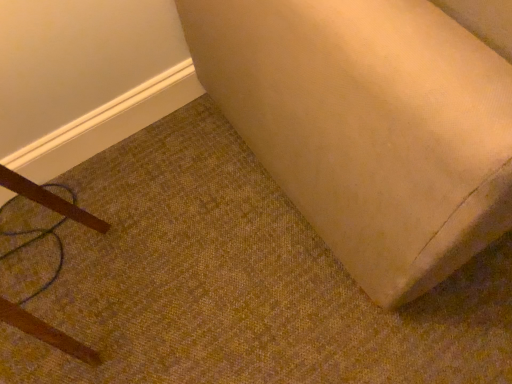
What do you see at coordinates (368, 126) in the screenshot?
I see `beige fabric ottoman at lower right` at bounding box center [368, 126].

Identify the location of beige fabric ottoman at lower right. This screenshot has height=384, width=512. (368, 126).

I want to click on beige fabric ottoman at lower right, so click(368, 126).